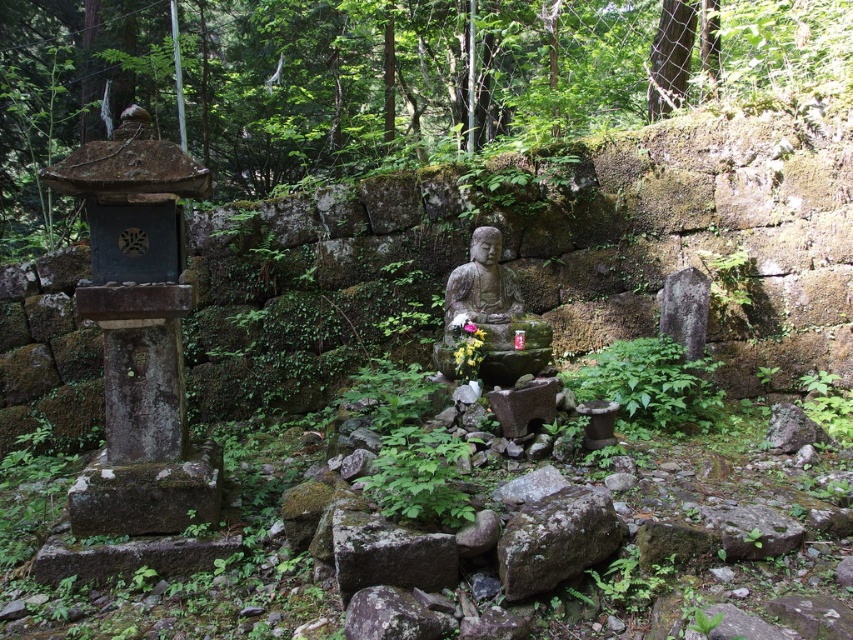
You are a gardener tasked with arranging plants around the gray rough stone at lower right and the pink matte flower at center. Which object should you place a smaller decorative item next to, based on their sizes?

The gray rough stone at lower right is larger in size than the pink matte flower at center, so you should place the smaller decorative item next to the pink matte flower at center.

You are standing in front of the shrine area and want to place a small offering at the gray rough stone at lower right. If your reach extends 1.8 meters, can you place the offering without moving closer?

The gray rough stone at lower right is 3.64 meters away from the camera. Since your reach extends only 1.8 meters, you cannot place the offering without moving closer.